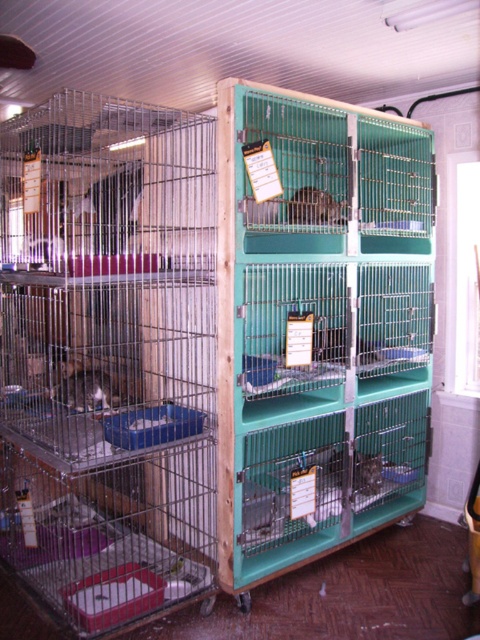
Question: Can you confirm if matte green cage at center is wider than shiny metallic cage at center?

Choices:
 (A) no
 (B) yes

Answer: (A)

Question: Which is farther from the white fur cat at left?

Choices:
 (A) teal plastic cage at center
 (B) shiny metallic cage at center
 (C) brushed metal cage at left

Answer: (B)

Question: Which point is closer to the camera?

Choices:
 (A) white fur cat at left
 (B) brushed metal cage at left

Answer: (B)

Question: From the image, what is the correct spatial relationship of brushed metal cage at left in relation to matte green cage at center?

Choices:
 (A) right
 (B) left

Answer: (B)

Question: Considering the relative positions of teal plastic cage at center and matte green cage at center in the image provided, where is teal plastic cage at center located with respect to matte green cage at center?

Choices:
 (A) above
 (B) below

Answer: (B)

Question: Which is farther from the shiny metallic cage at center?

Choices:
 (A) white fur cat at left
 (B) matte green cage at center
 (C) teal plastic cage at center
 (D) brushed metal cage at left

Answer: (D)